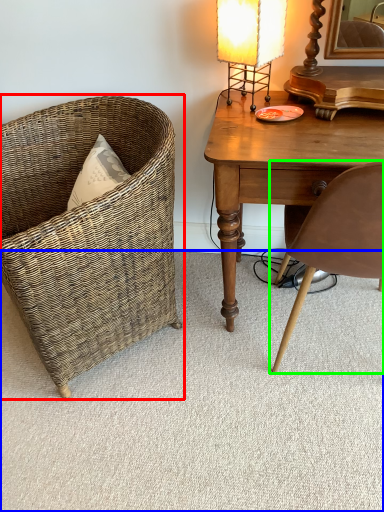
Question: Which object is the closest to the chair (highlighted by a red box)? Choose among these: plain (highlighted by a blue box) or chair (highlighted by a green box).

Choices:
 (A) plain
 (B) chair

Answer: (A)